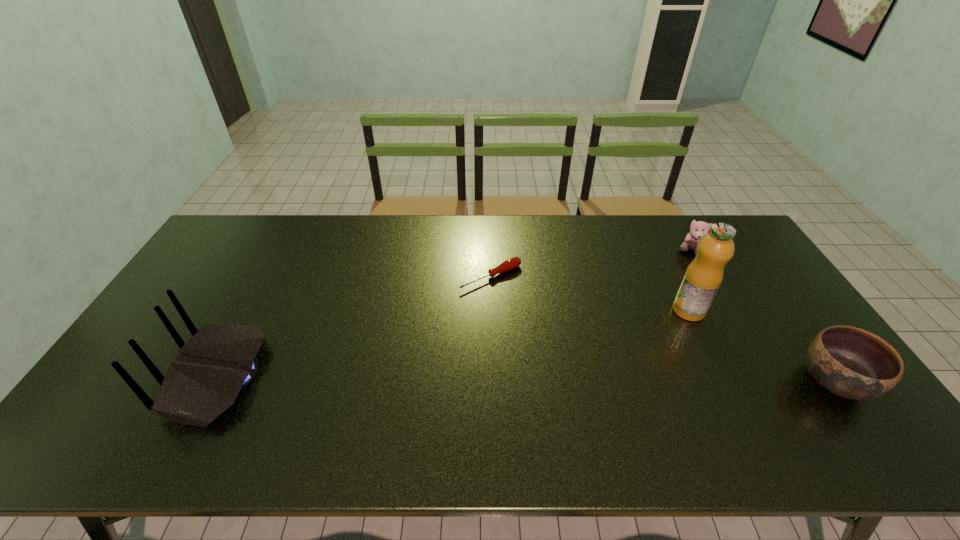
Identify the location of free space on the desktop that is between the second tallest object and the bowl and is positioned at the tip of the screwdriver. Image resolution: width=960 pixels, height=540 pixels. (599, 380).

Locate an element on the screen. The width and height of the screenshot is (960, 540). free space on the desktop that is between the router and the rightmost object and is positioned on the front label of the fruit juice is located at coordinates (585, 380).

Identify the location of free space on the desktop that is between the fourth shortest object and the bowl and is positioned at the face of the teddy bear. (561, 380).